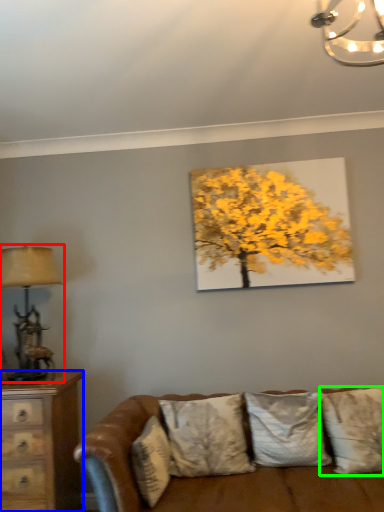
Question: Considering the real-world distances, which object is farthest from table lamp (highlighted by a red box)? chest of drawers (highlighted by a blue box) or pillow (highlighted by a green box)?

Choices:
 (A) chest of drawers
 (B) pillow

Answer: (B)